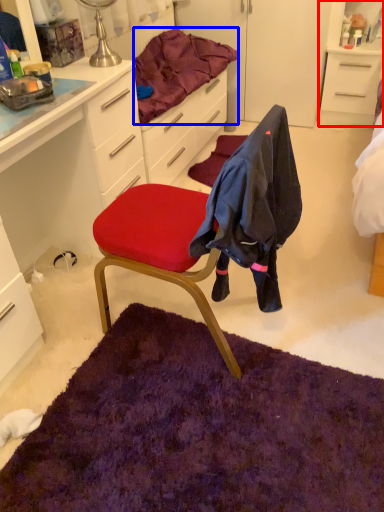
Question: Among these objects, which one is farthest to the camera, cabinetry (highlighted by a red box) or bedding (highlighted by a blue box)?

Choices:
 (A) cabinetry
 (B) bedding

Answer: (A)